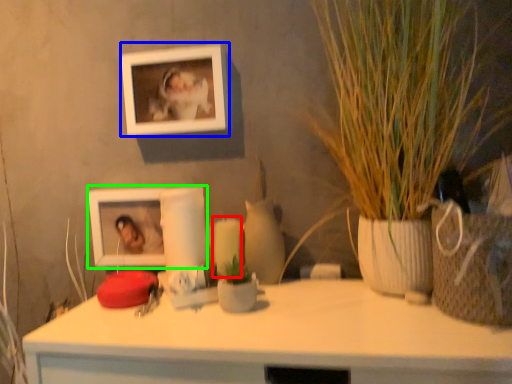
Question: Which object is positioned farthest from candle (highlighted by a red box)? Select from picture frame (highlighted by a blue box) and picture frame (highlighted by a green box).

Choices:
 (A) picture frame
 (B) picture frame

Answer: (A)